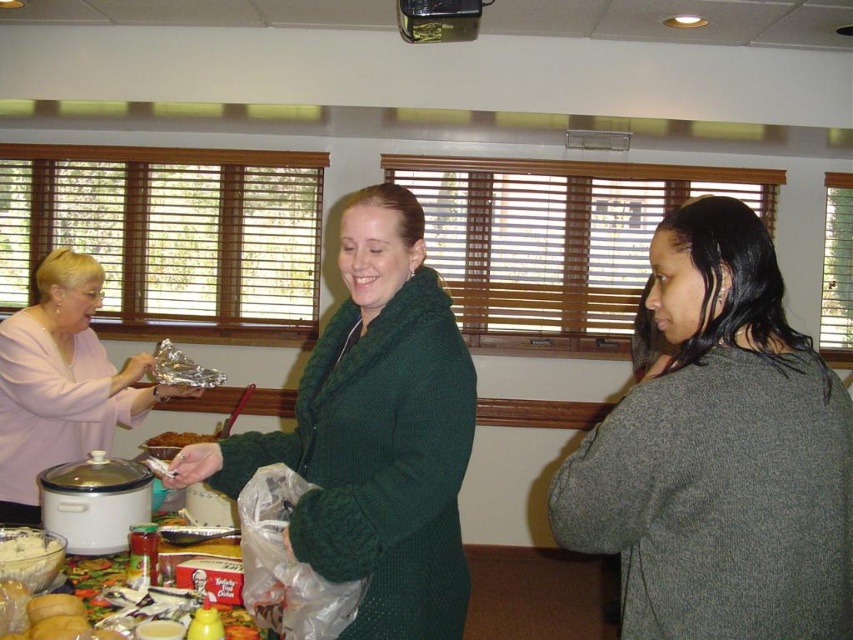
Is gray wool sweater at right above plastic tableware at lower left?

Yes, gray wool sweater at right is above plastic tableware at lower left.

Who is shorter, gray wool sweater at right or plastic tableware at lower left?

Standing shorter between the two is plastic tableware at lower left.

Is point (579, 529) more distant than point (99, 614)?

That is False.

Identify the location of gray wool sweater at right. (718, 452).

Is plastic tableware at lower left above white creamy dip at lower left?

No, plastic tableware at lower left is not above white creamy dip at lower left.

Is plastic tableware at lower left below white creamy dip at lower left?

Indeed, plastic tableware at lower left is positioned under white creamy dip at lower left.

The width and height of the screenshot is (853, 640). In order to click on plastic tableware at lower left in this screenshot , I will do `click(91, 579)`.

Locate an element on the screen. This screenshot has height=640, width=853. plastic tableware at lower left is located at coordinates (91, 579).

Is point (780, 548) positioned in front of point (125, 410)?

Yes.

Is the position of gray wool sweater at right more distant than that of matte pink sweater at left?

That is False.

Which is in front, point (650, 285) or point (71, 305)?

Point (71, 305) is more forward.

Image resolution: width=853 pixels, height=640 pixels. I want to click on gray wool sweater at right, so click(718, 452).